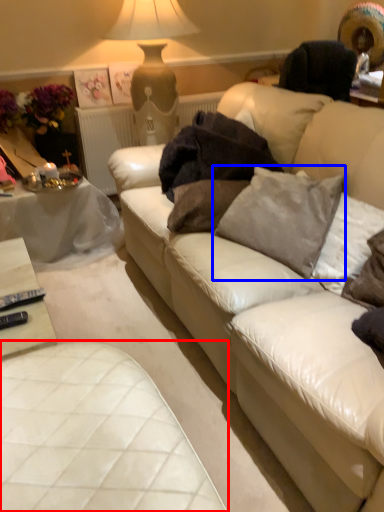
Question: Which point is closer to the camera, table (highlighted by a red box) or pillow (highlighted by a blue box)?

Choices:
 (A) table
 (B) pillow

Answer: (A)